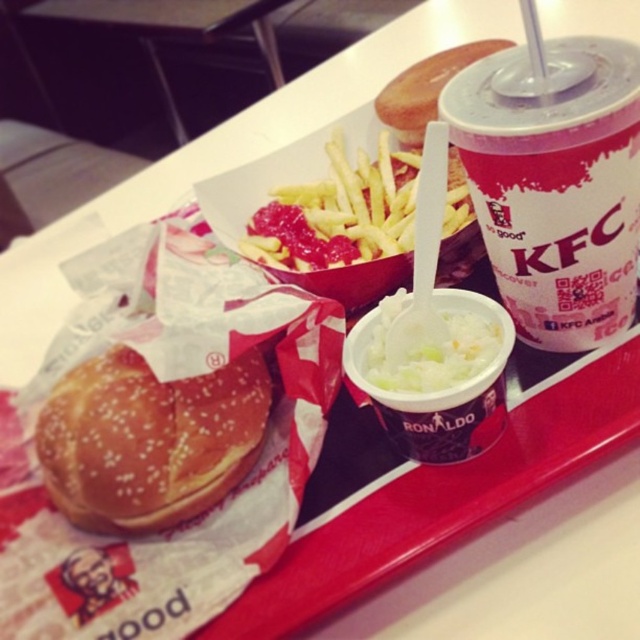
You are placing an order at KFC and want to grab the white paper cup with straw at upper right. Based on the coordinates provided, where should you look on the tray to find it?

The white paper cup with straw at upper right is located at point (554,182) on the tray.

You are a customer at KFC and want to take a photo of your meal. You notice two points on the tray, one at point (x=593, y=204) and another at point (x=406, y=182). Which point is closer to the camera so that it appears larger in your photo?

Point (x=593, y=204) is closer to the camera than point (x=406, y=182), so it will appear larger in the photo.